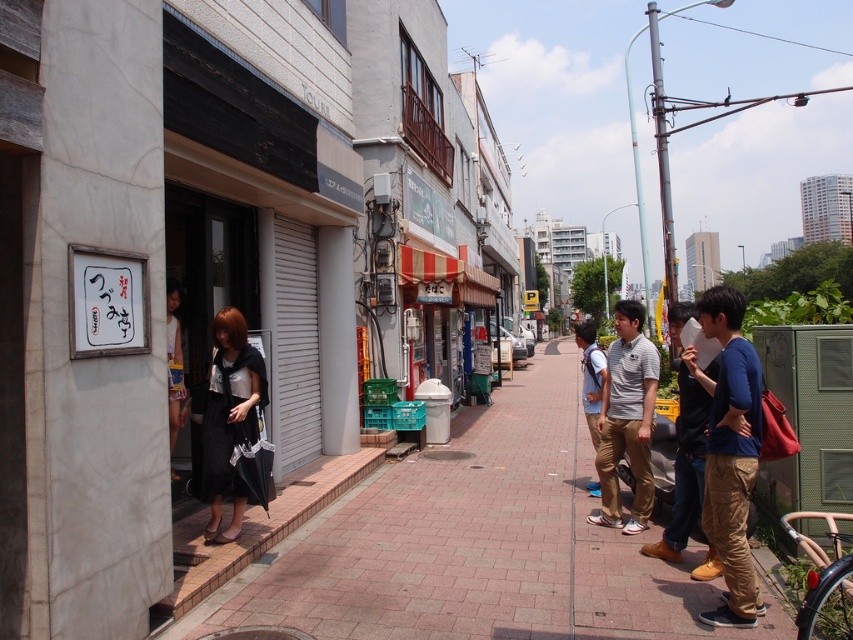
Question: Can you confirm if brick pavement at center is thinner than white cotton dress at left?

Choices:
 (A) no
 (B) yes

Answer: (A)

Question: Which point appears farthest from the camera in this image?

Choices:
 (A) (180, 342)
 (B) (601, 490)

Answer: (B)

Question: Which of the following is the closest to the observer?

Choices:
 (A) (242, 369)
 (B) (172, 400)

Answer: (A)

Question: Is black matte dress at center further to the viewer compared to blue jeans at center?

Choices:
 (A) yes
 (B) no

Answer: (A)

Question: Is blue cotton shirt at right behind white cotton dress at left?

Choices:
 (A) no
 (B) yes

Answer: (A)

Question: Estimate the real-world distances between objects in this image. Which object is closer to the gray cotton polo shirt at center?

Choices:
 (A) black matte dress at center
 (B) white cotton dress at left
 (C) blue cotton shirt at right

Answer: (C)